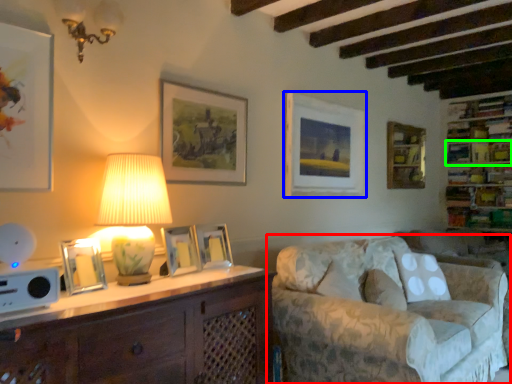
Question: Estimate the real-world distances between objects in this image. Which object is closer to studio couch (highlighted by a red box), picture frame (highlighted by a blue box) or shelf (highlighted by a green box)?

Choices:
 (A) picture frame
 (B) shelf

Answer: (A)